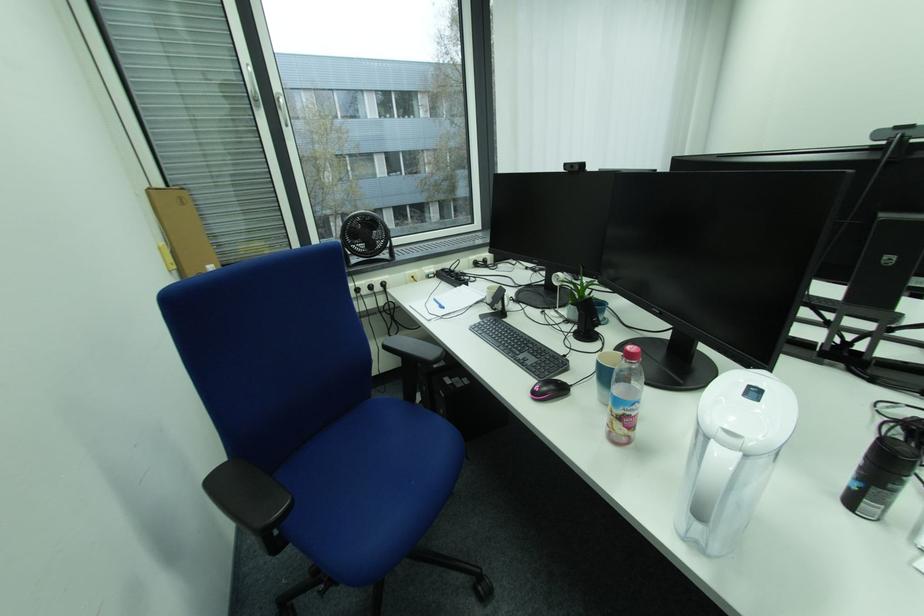
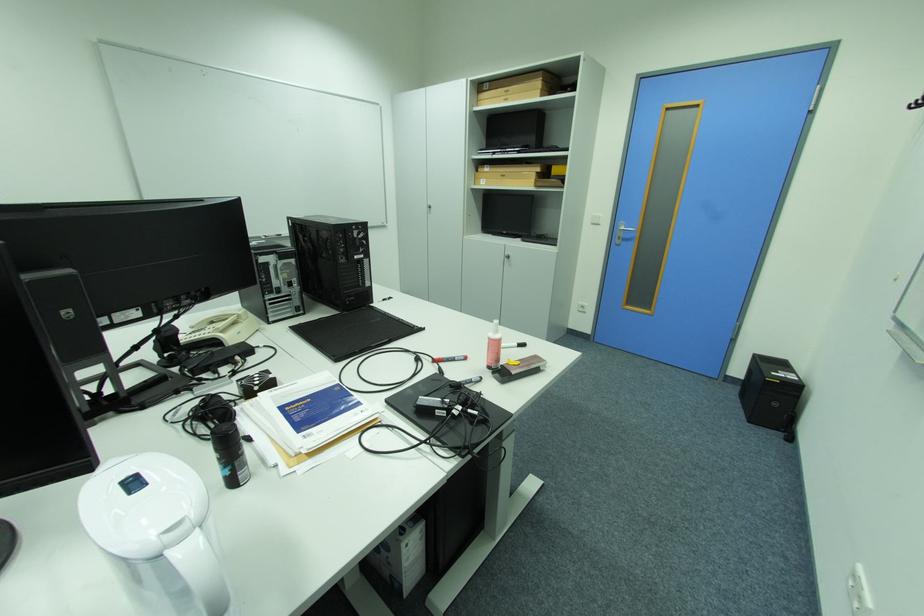
How did the camera likely rotate?

The rotation direction of the camera is right-down.